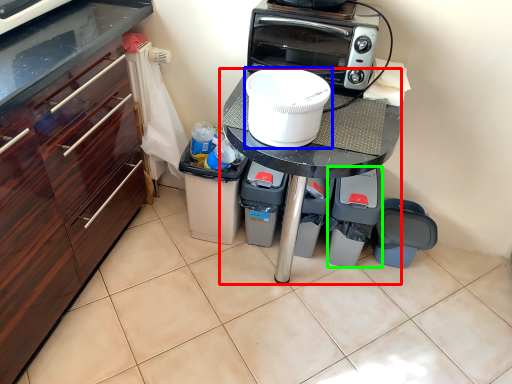
Question: Estimate the real-world distances between objects in this image. Which object is farther from table (highlighted by a red box), home appliance (highlighted by a blue box) or appliance (highlighted by a green box)?

Choices:
 (A) home appliance
 (B) appliance

Answer: (B)